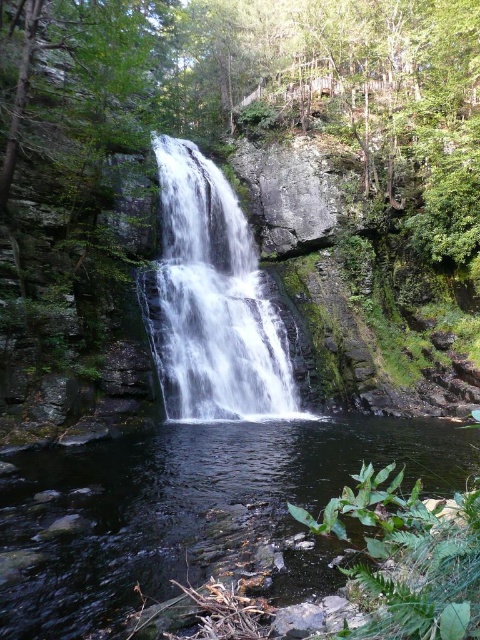
Question: Can you confirm if clear water at center is positioned above white smooth waterfall at center?

Choices:
 (A) yes
 (B) no

Answer: (B)

Question: Is clear water at center thinner than white smooth waterfall at center?

Choices:
 (A) yes
 (B) no

Answer: (B)

Question: Among these objects, which one is farthest from the camera?

Choices:
 (A) white smooth waterfall at center
 (B) clear water at center

Answer: (A)

Question: Which point is closer to the camera?

Choices:
 (A) (110, 541)
 (B) (167, 285)

Answer: (A)

Question: Which of the following is the closest to the observer?

Choices:
 (A) clear water at center
 (B) white smooth waterfall at center

Answer: (A)

Question: Does clear water at center lie behind white smooth waterfall at center?

Choices:
 (A) no
 (B) yes

Answer: (A)